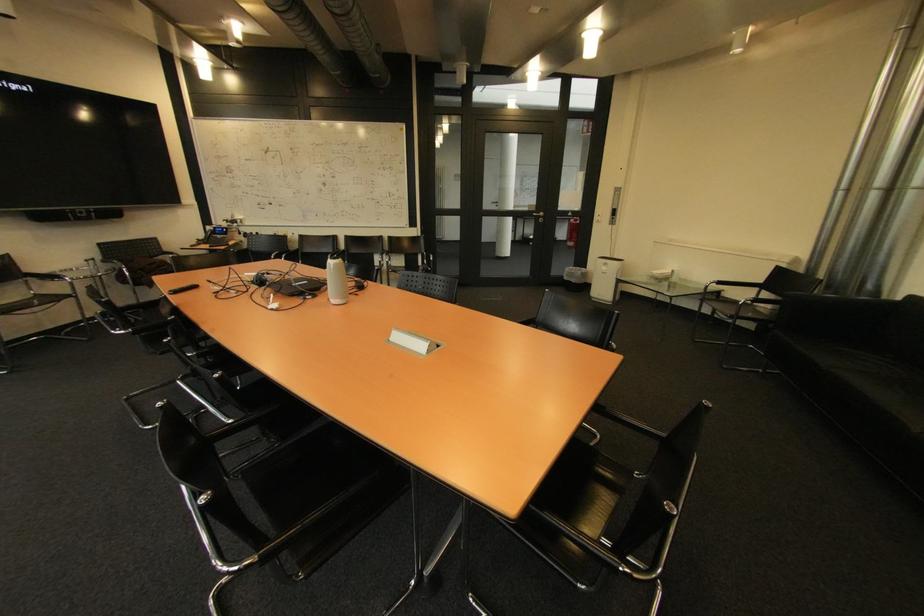
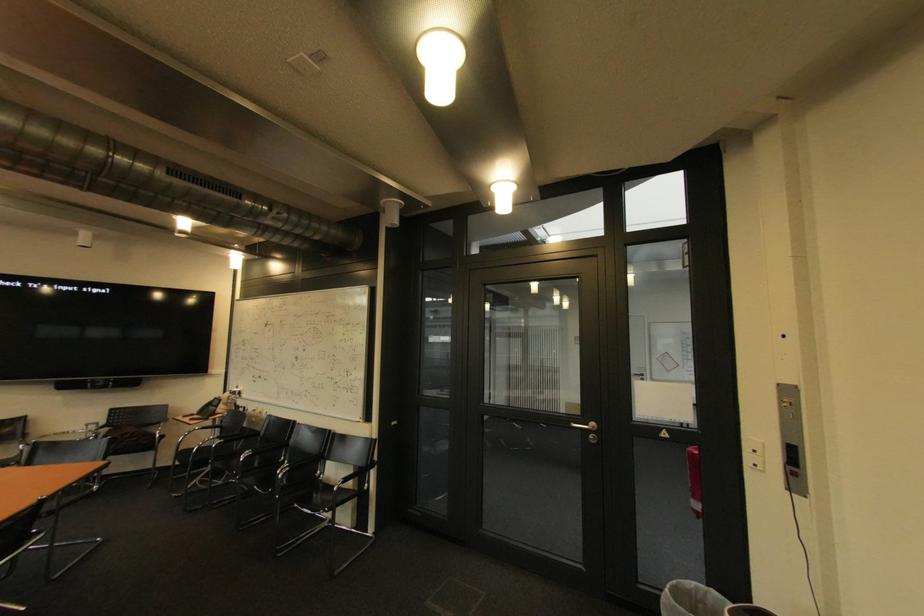
Where in the second image is the point corresponding to point (213, 245) from the first image?

(204, 416)